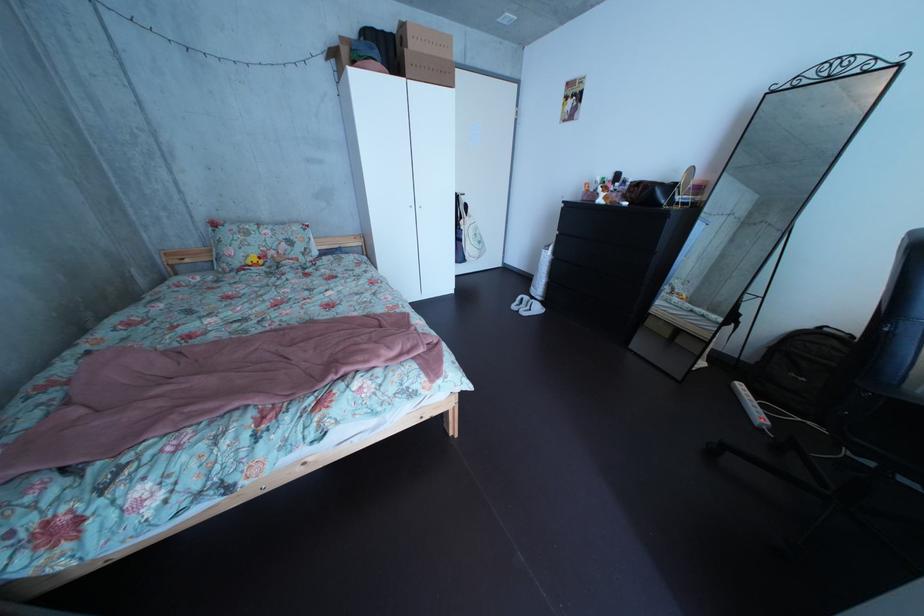
Where would you pull the white door handle? Please return your answer as a coordinate pair (x, y).

(421, 209)